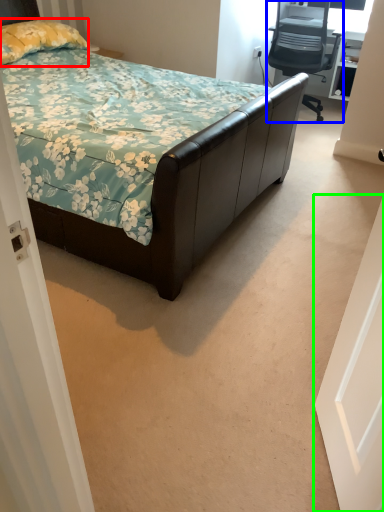
Question: Which is farther away from pillow (highlighted by a red box)? chair (highlighted by a blue box) or door (highlighted by a green box)?

Choices:
 (A) chair
 (B) door

Answer: (B)